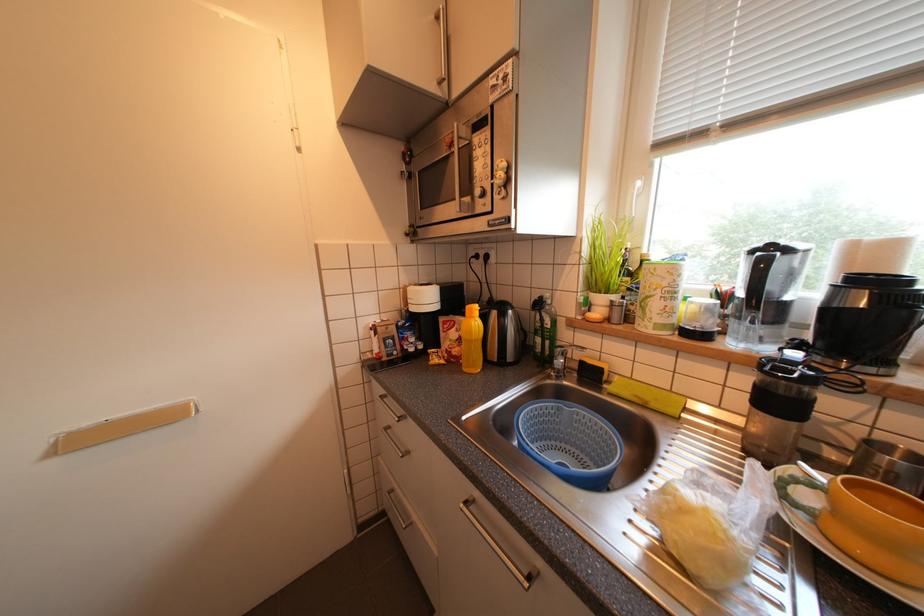
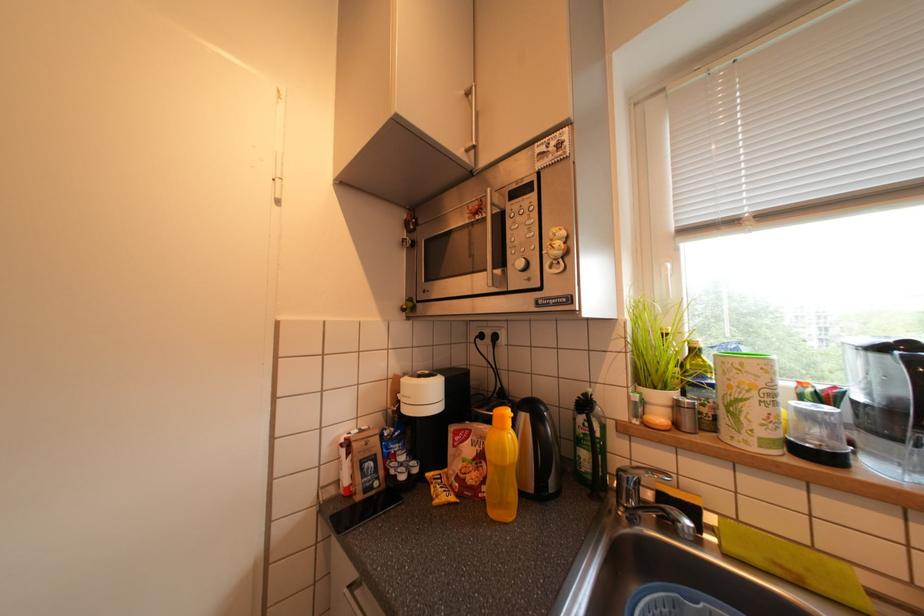
The images are taken continuously from a first-person perspective. In which direction are you moving?

The movement direction of the cameraman is left, forward.